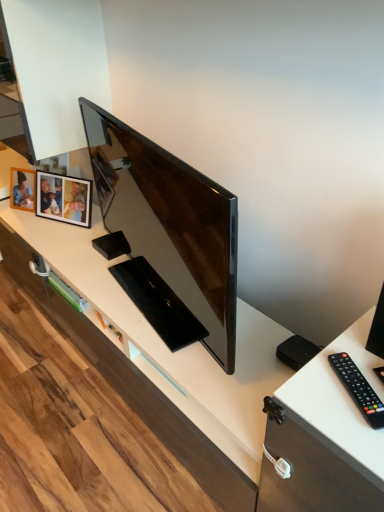
Question: Do you think matte black tv at center is within wooden photo frame at upper left, or outside of it?

Choices:
 (A) inside
 (B) outside

Answer: (B)

Question: From the image's perspective, relative to wooden photo frame at upper left, is matte black tv at center above or below?

Choices:
 (A) above
 (B) below

Answer: (B)

Question: Which of these objects is positioned farthest from the wooden photo frame at upper left?

Choices:
 (A) black plastic remote at right
 (B) matte black tv at center

Answer: (A)

Question: Estimate the real-world distances between objects in this image. Which object is farther from the wooden photo frame at upper left?

Choices:
 (A) black plastic remote at right
 (B) matte black tv at center

Answer: (A)